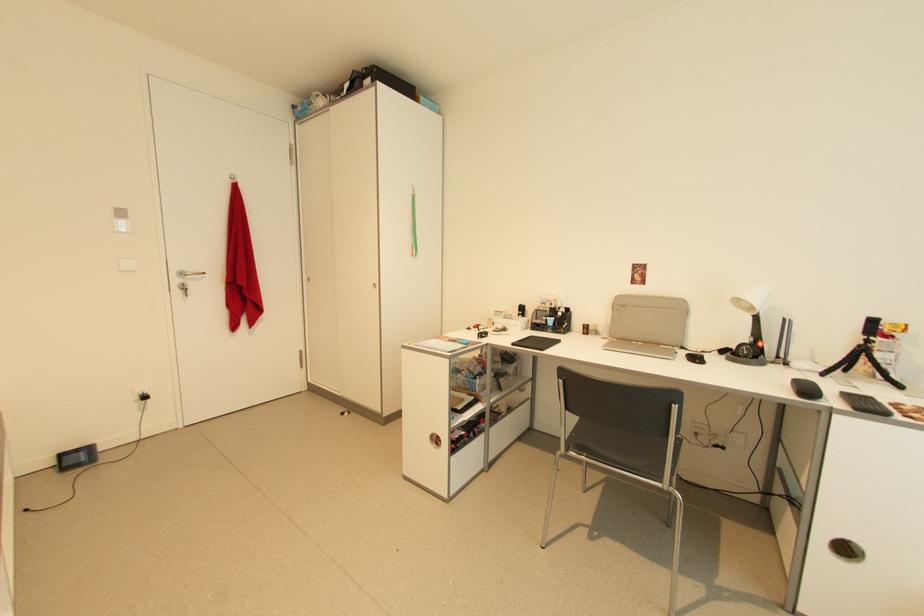
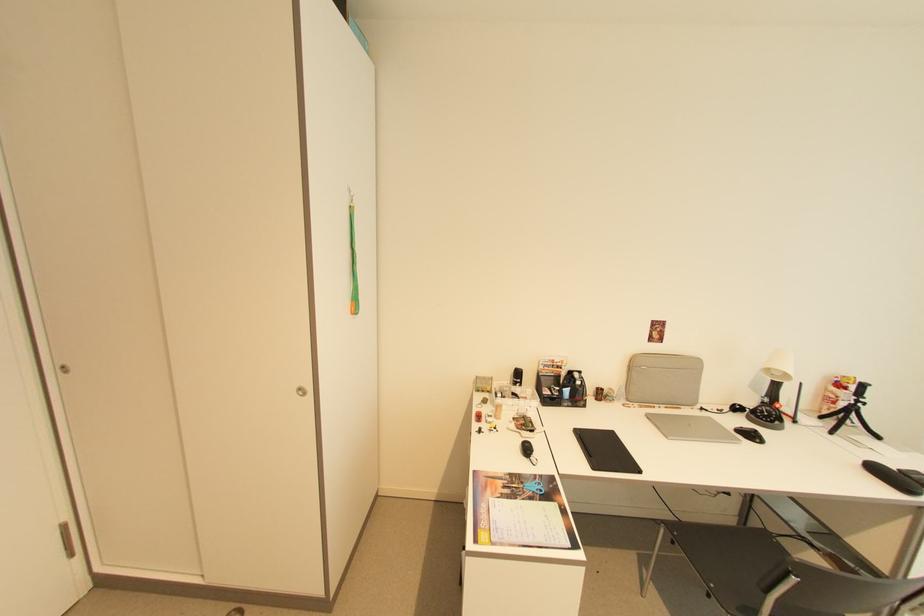
The point at (625, 307) is marked in the first image. Where is the corresponding point in the second image?

(638, 366)